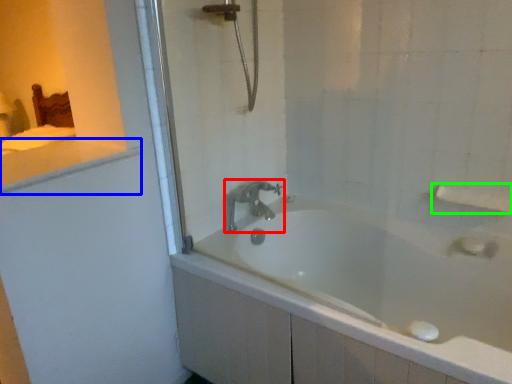
Question: Which object is the closest to the tap (highlighted by a red box)? Choose among these: counter top (highlighted by a blue box) or towel bar (highlighted by a green box).

Choices:
 (A) counter top
 (B) towel bar

Answer: (A)